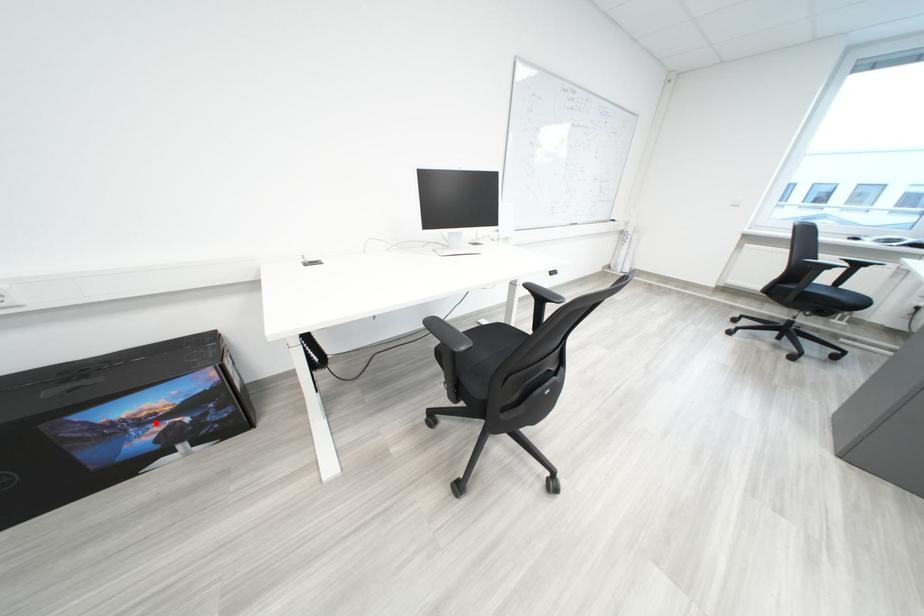
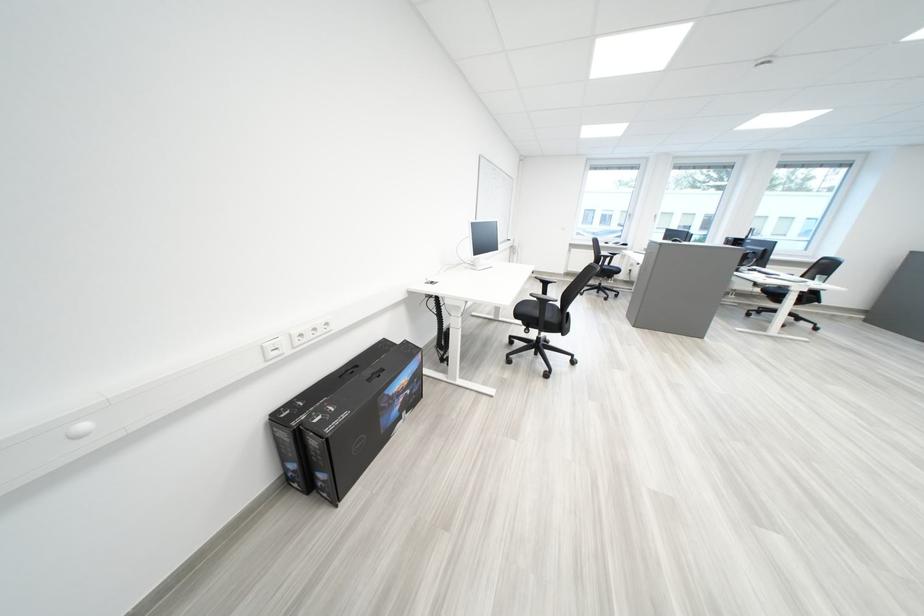
The point at the highlighted location is marked in the first image. Where is the corresponding point in the second image?

(411, 395)